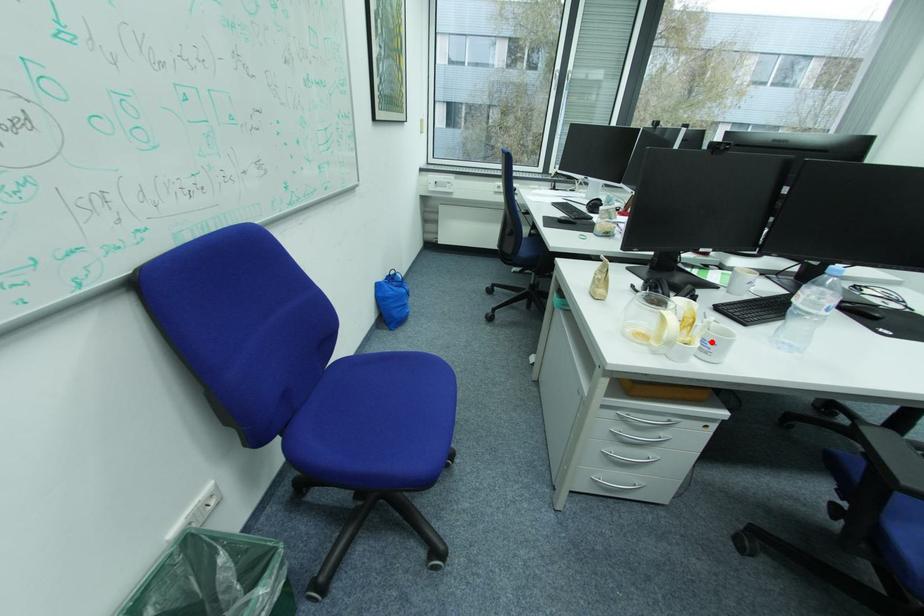
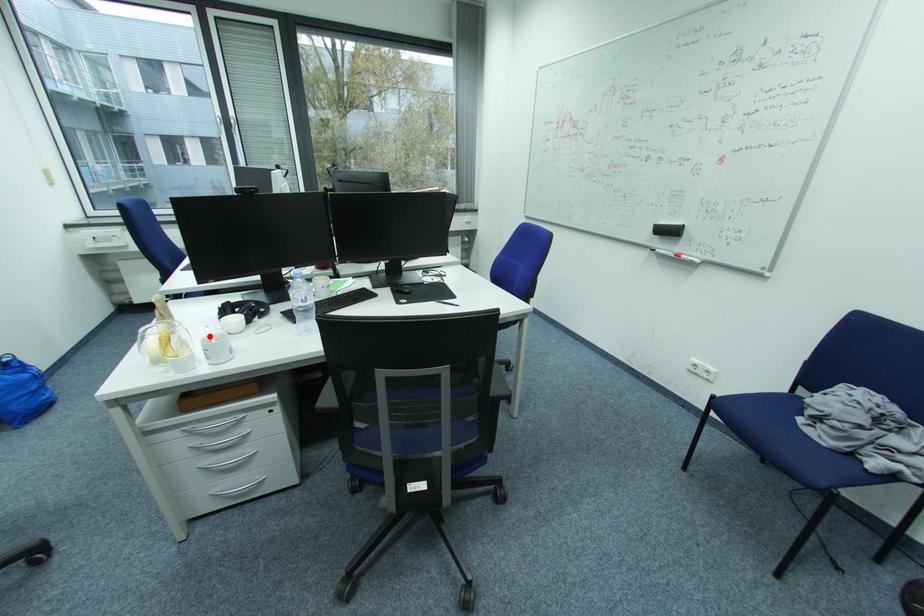
I am providing you with two images of the same scene from different viewpoints. A red point is marked on the first image and another point is marked on the second image. Does the point marked in image1 correspond to the same location as the one in image2?

No